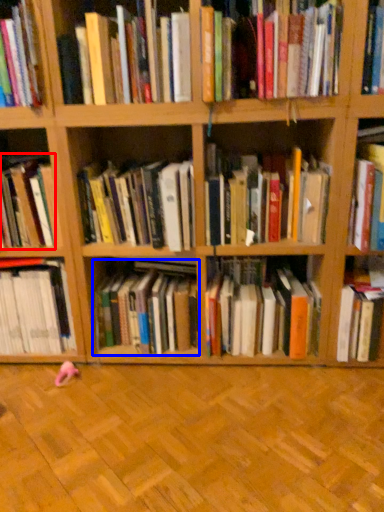
Question: Among these objects, which one is nearest to the camera, book (highlighted by a red box) or book (highlighted by a blue box)?

Choices:
 (A) book
 (B) book

Answer: (A)